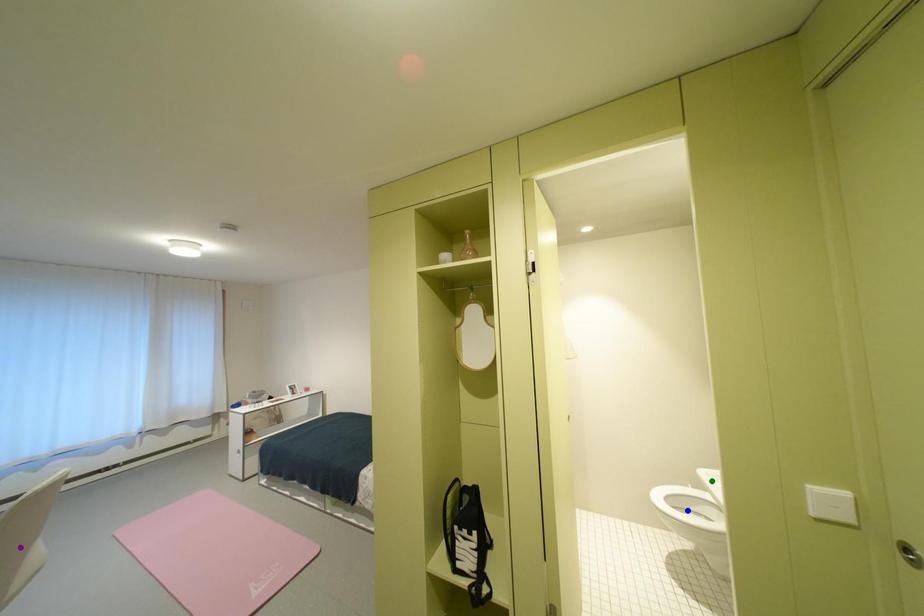
Order these from nearest to farthest:
blue point | purple point | green point

purple point
green point
blue point